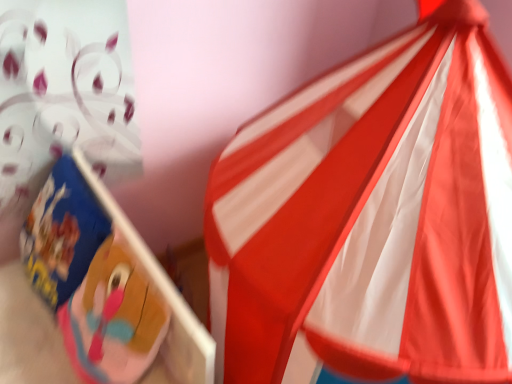
Question: Is blue cardboard box at left bigger or smaller than red/white striped tent at upper right?

Choices:
 (A) big
 (B) small

Answer: (B)

Question: Would you say blue cardboard box at left is to the left or to the right of red/white striped tent at upper right in the picture?

Choices:
 (A) left
 (B) right

Answer: (A)

Question: Do you think blue cardboard box at left is within red/white striped tent at upper right, or outside of it?

Choices:
 (A) inside
 (B) outside

Answer: (B)

Question: Is point (423, 39) positioned closer to the camera than point (134, 344)?

Choices:
 (A) farther
 (B) closer

Answer: (B)

Question: Is red/white striped tent at upper right spatially inside blue cardboard box at left, or outside of it?

Choices:
 (A) outside
 (B) inside

Answer: (A)

Question: Considering the positions of red/white striped tent at upper right and blue cardboard box at left in the image, is red/white striped tent at upper right wider or thinner than blue cardboard box at left?

Choices:
 (A) wide
 (B) thin

Answer: (A)

Question: From the image's perspective, is red/white striped tent at upper right located above or below blue cardboard box at left?

Choices:
 (A) below
 (B) above

Answer: (B)